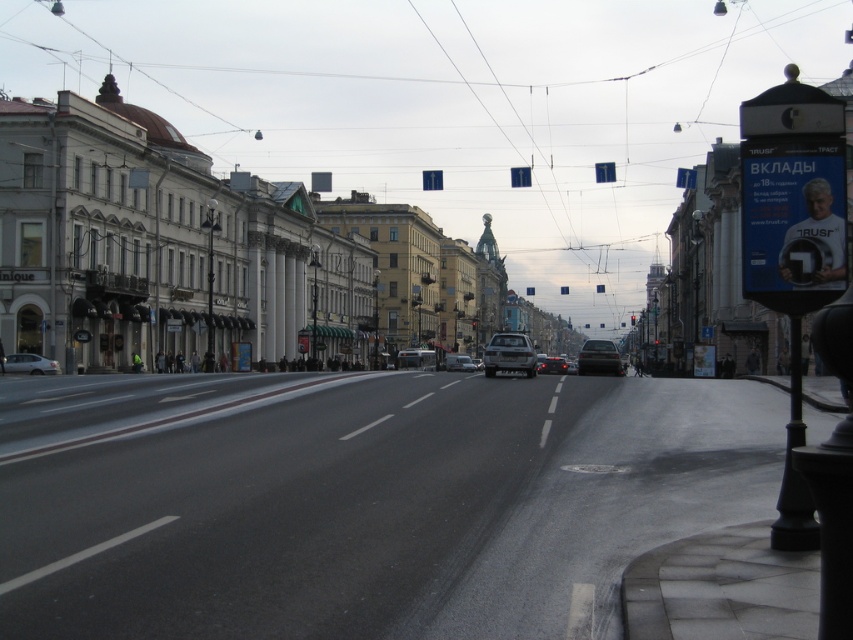
Can you confirm if metallic silver car at center is positioned above matte silver van at center?

Indeed, metallic silver car at center is positioned over matte silver van at center.

Who is shorter, metallic silver car at center or matte silver van at center?

matte silver van at center is shorter.

Describe the element at coordinates (509, 355) in the screenshot. I see `metallic silver car at center` at that location.

The image size is (853, 640). Identify the location of metallic silver car at center. (509, 355).

Does metallic silver car at center appear on the right side of silver metallic suv at center?

Yes, metallic silver car at center is to the right of silver metallic suv at center.

Does metallic silver car at center come in front of silver metallic suv at center?

Yes.

Who is more distant from viewer, (502, 337) or (465, 358)?

Point (465, 358)

I want to click on metallic silver car at center, so click(x=509, y=355).

Between dark gray metallic car at center and silver metallic suv at center, which one has less height?

silver metallic suv at center

Describe the element at coordinates (599, 356) in the screenshot. This screenshot has width=853, height=640. I see `dark gray metallic car at center` at that location.

At what (x,y) coordinates should I click in order to perform the action: click on dark gray metallic car at center. Please return your answer as a coordinate pair (x, y). This screenshot has height=640, width=853. Looking at the image, I should click on (599, 356).